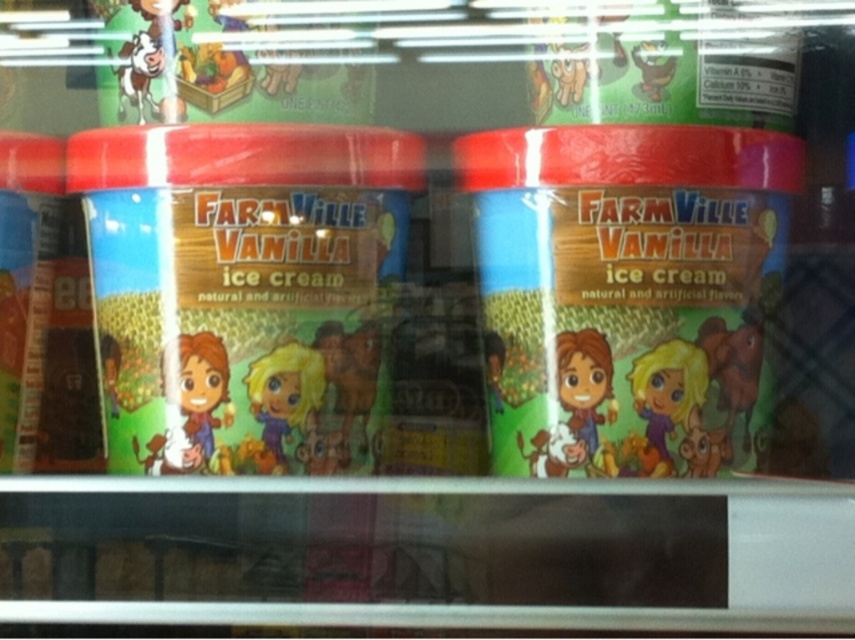
Does matte plastic ice cream container at center have a lesser height compared to matte plastic tub at left?

In fact, matte plastic ice cream container at center may be taller than matte plastic tub at left.

Between matte plastic ice cream container at center and matte plastic tub at left, which one appears on the right side from the viewer's perspective?

Positioned to the right is matte plastic ice cream container at center.

Locate an element on the screen. The width and height of the screenshot is (855, 640). matte plastic ice cream container at center is located at coordinates click(240, 289).

Where is `matte plastic ice cream container at center`? This screenshot has height=640, width=855. matte plastic ice cream container at center is located at coordinates [x=240, y=289].

Measure the distance from matte plastic ice cream container at center to matte plastic farmville vanilla ice cream at center.

matte plastic ice cream container at center and matte plastic farmville vanilla ice cream at center are 17.43 centimeters apart from each other.

Is point (260, 246) closer to viewer compared to point (718, 465)?

Yes, point (260, 246) is in front of point (718, 465).

Which is in front, point (246, 177) or point (585, 170)?

Point (585, 170) is more forward.

Identify the location of matte plastic ice cream container at center. (240, 289).

Can you confirm if matte plastic farmville vanilla ice cream at center is shorter than matte plastic tub at left?

No, matte plastic farmville vanilla ice cream at center is not shorter than matte plastic tub at left.

From the picture: Is matte plastic farmville vanilla ice cream at center taller than matte plastic tub at left?

Yes.

Does point (576, 284) lie in front of point (9, 358)?

Yes.

Image resolution: width=855 pixels, height=640 pixels. Identify the location of matte plastic farmville vanilla ice cream at center. (626, 291).